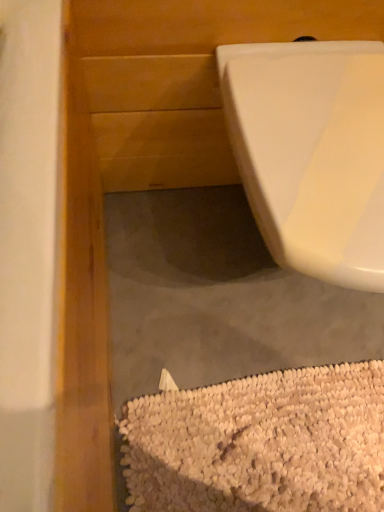
Where is `vacant area on top of white glossy toilet at upper right (from a real-world perspective)`? The image size is (384, 512). vacant area on top of white glossy toilet at upper right (from a real-world perspective) is located at coordinates 319,114.